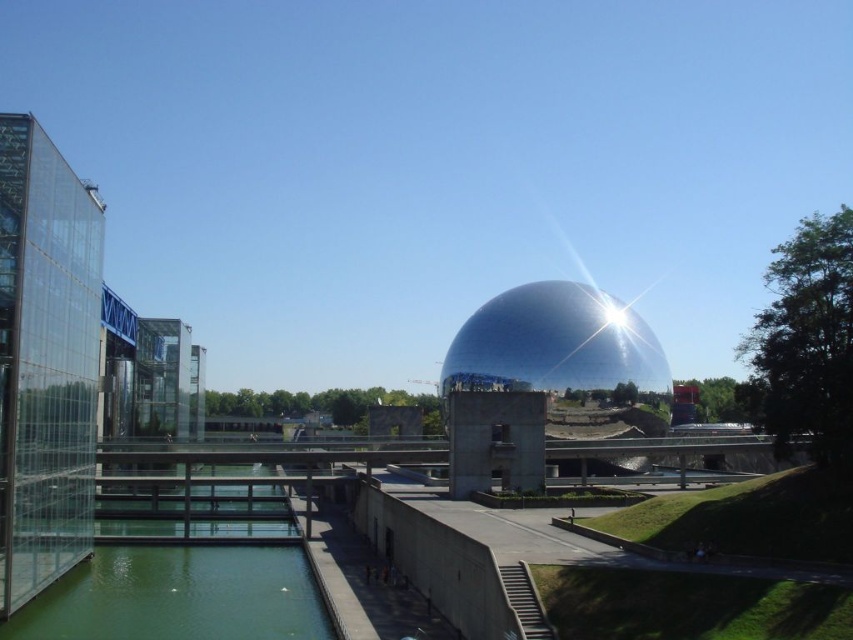
Question: Which object appears closest to the camera in this image?

Choices:
 (A) glossy metallic dome at center
 (B) green glass water at lower left

Answer: (B)

Question: Does green glass water at lower left have a lesser width compared to glossy metallic dome at center?

Choices:
 (A) yes
 (B) no

Answer: (A)

Question: Among these points, which one is nearest to the camera?

Choices:
 (A) (149, 609)
 (B) (543, 337)

Answer: (A)

Question: Which object is farther from the camera taking this photo?

Choices:
 (A) glossy metallic dome at center
 (B) green glass water at lower left

Answer: (A)

Question: Can you confirm if green glass water at lower left is positioned to the left of glossy metallic dome at center?

Choices:
 (A) yes
 (B) no

Answer: (A)

Question: Is green glass water at lower left below glossy metallic dome at center?

Choices:
 (A) no
 (B) yes

Answer: (B)